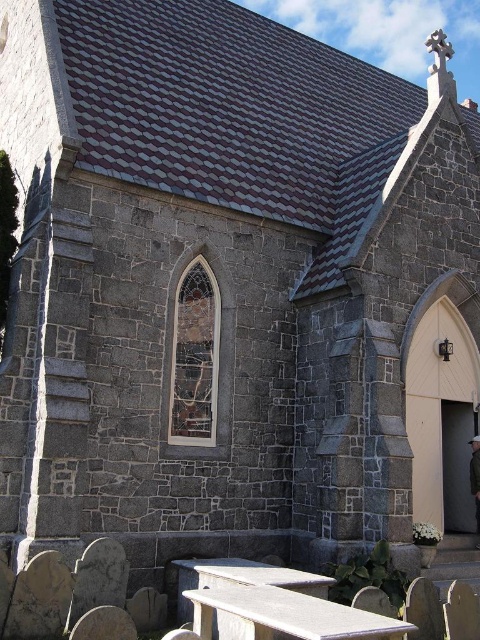
Which is behind, point (284, 637) or point (475, 452)?

Positioned behind is point (475, 452).

Is smooth gray picnic table at lower center thinner than dark brown leather jacket at lower right?

No.

Between point (312, 573) and point (475, 445), which one is positioned behind?

The point (475, 445) is more distant.

What are the coordinates of `smooth gray picnic table at lower center` in the screenshot? It's located at (241, 579).

Does smooth gray bench at lower center have a lesser width compared to dark brown leather jacket at lower right?

No.

Image resolution: width=480 pixels, height=640 pixels. What do you see at coordinates (289, 614) in the screenshot? I see `smooth gray bench at lower center` at bounding box center [289, 614].

Identify the location of smooth gray bench at lower center. [289, 614].

Is smooth gray bench at lower center thinner than smooth gray picnic table at lower center?

No, smooth gray bench at lower center is not thinner than smooth gray picnic table at lower center.

Does smooth gray bench at lower center have a smaller size compared to smooth gray picnic table at lower center?

Yes, smooth gray bench at lower center is smaller than smooth gray picnic table at lower center.

Who is more distant from viewer, (264, 628) or (304, 582)?

Point (304, 582)

Where is `smooth gray bench at lower center`? Image resolution: width=480 pixels, height=640 pixels. smooth gray bench at lower center is located at coordinates (289, 614).